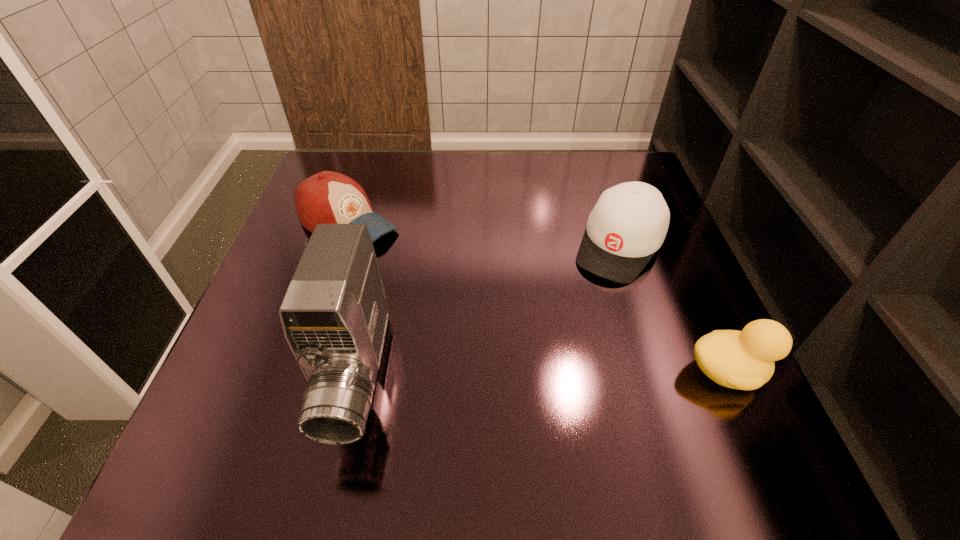
The width and height of the screenshot is (960, 540). Identify the location of camcorder. coord(334,315).

This screenshot has width=960, height=540. In order to click on duck in this screenshot , I will do `click(744, 360)`.

Where is `the left baseball cap`? Image resolution: width=960 pixels, height=540 pixels. the left baseball cap is located at coordinates (327, 197).

Locate an element on the screen. This screenshot has width=960, height=540. the right baseball cap is located at coordinates (628, 224).

The width and height of the screenshot is (960, 540). I want to click on vacant area situated 0.100m on the front-facing side of the left baseball cap, so click(x=415, y=262).

Identify the location of vacant space situated 0.220m on the front-facing side of the left baseball cap. (455, 287).

You are a GUI agent. You are given a task and a screenshot of the screen. Output one action in this format:
    pyautogui.click(x=<x>, y=<y>)
    Task: Click on the free region located 0.330m on the front-facing side of the left baseball cap
    The height and width of the screenshot is (540, 960).
    Given the screenshot: What is the action you would take?
    pyautogui.click(x=496, y=312)

Locate an element on the screen. This screenshot has height=540, width=960. vacant space located 0.240m on the front-facing side of the right baseball cap is located at coordinates (555, 359).

Locate an element on the screen. This screenshot has width=960, height=540. vacant space situated on the front-facing side of the right baseball cap is located at coordinates (520, 415).

This screenshot has height=540, width=960. I want to click on vacant area situated 0.070m on the front-facing side of the right baseball cap, so click(590, 300).